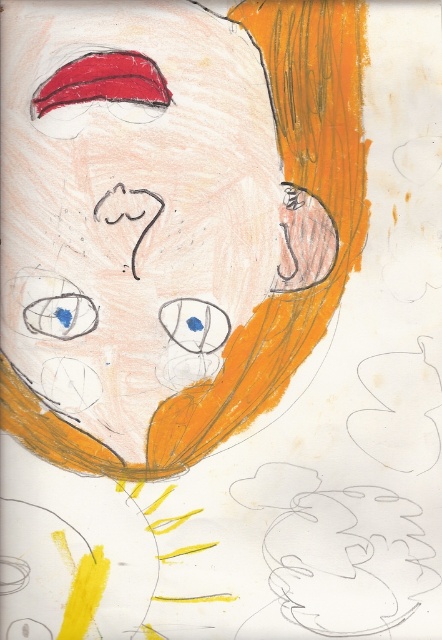
From the picture: You are a child trying to color in the drawing. You have a marker that can only color over objects that are behind others. Which object should you color first between the matte orange hair at upper right and the blue matte eye at upper left?

You should color the blue matte eye at upper left first because the matte orange hair at upper right is in front of it, so you need to color the one behind first.

In the child drawing, there is a point at coordinates (194, 324). Which object in the drawing does this point belong to?

The point at coordinates (194, 324) is on the blue matte eye at center.

You are an art teacher evaluating a child drawing. You notice the matte orange hair at upper right and the blue matte eye at center. Which object in the drawing is larger?

The matte orange hair at upper right is bigger than the blue matte eye at center.